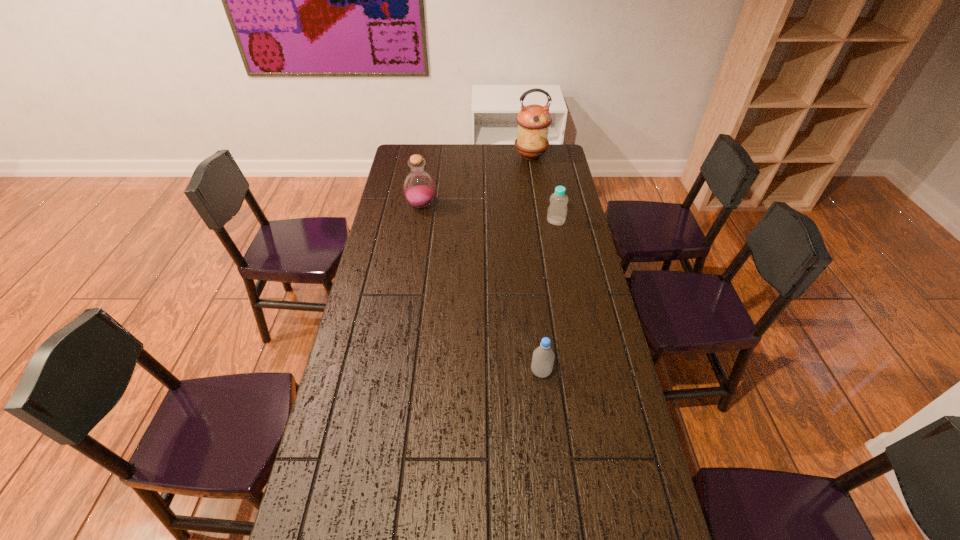
Image resolution: width=960 pixels, height=540 pixels. Identify the location of empty space between the tallest object and the tallest bottle. (476, 181).

This screenshot has height=540, width=960. Identify the location of free spot between the second bottle from right to left and the leftmost object. (481, 289).

I want to click on vacant space that is in between the oil lamp and the second nearest object, so click(x=543, y=189).

The width and height of the screenshot is (960, 540). Identify the location of empty space that is in between the third farthest object and the nearest bottle. (548, 296).

You are a GUI agent. You are given a task and a screenshot of the screen. Output one action in this format:
    pyautogui.click(x=<x>, y=<y>)
    Task: Click on the blank region between the third shortest object and the second nearest object
    This screenshot has height=540, width=960.
    Given the screenshot: What is the action you would take?
    pyautogui.click(x=489, y=213)

Image resolution: width=960 pixels, height=540 pixels. I want to click on vacant space that's between the tallest object and the second nearest object, so click(x=543, y=189).

Image resolution: width=960 pixels, height=540 pixels. Identify the location of free point between the rightmost bottle and the farthest object. (543, 189).

At what (x,y) coordinates should I click in order to perform the action: click on free spot between the tallest object and the rightmost bottle. Please return your answer as a coordinate pair (x, y). This screenshot has width=960, height=540. Looking at the image, I should click on (543, 189).

The height and width of the screenshot is (540, 960). I want to click on free space that is in between the leftmost bottle and the second nearest bottle, so [x=489, y=213].

Identify which object is the third nearest to the second nearest object. Please provide its 2D coordinates. Your answer should be formatted as a tuple, i.e. [(x, y)], where the tuple contains the x and y coordinates of a point satisfying the conditions above.

[(543, 357)]